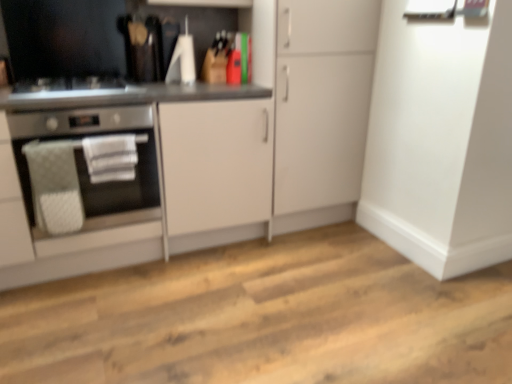
Question: Which direction should I rotate to look at white matte cabinet at center, which appears as the second cabinetry when viewed from the left, — up or down?

Choices:
 (A) up
 (B) down

Answer: (A)

Question: Is stainless steel oven at left positioned with its back to white matte cabinet at center, the 1th cabinetry viewed from the right?

Choices:
 (A) yes
 (B) no

Answer: (B)

Question: Can you confirm if stainless steel oven at left is positioned to the right of white matte cabinet at center, the 1th cabinetry viewed from the right?

Choices:
 (A) no
 (B) yes

Answer: (A)

Question: From a real-world perspective, does stainless steel oven at left sit lower than white matte cabinet at center, the 1th cabinetry viewed from the right?

Choices:
 (A) yes
 (B) no

Answer: (A)

Question: Is stainless steel oven at left next to white matte cabinet at center, which appears as the second cabinetry when viewed from the left?

Choices:
 (A) yes
 (B) no

Answer: (B)

Question: Is stainless steel oven at left at the left side of white matte cabinet at center, the 1th cabinetry viewed from the right?

Choices:
 (A) no
 (B) yes

Answer: (B)

Question: Does stainless steel oven at left have a larger size compared to white matte cabinet at center, which appears as the second cabinetry when viewed from the left?

Choices:
 (A) yes
 (B) no

Answer: (B)

Question: Is white matte cabinet at center, which appears as the second cabinetry when viewed from the left, taller than stainless steel oven at left?

Choices:
 (A) yes
 (B) no

Answer: (A)

Question: Is white matte cabinet at center, which appears as the second cabinetry when viewed from the left, directly adjacent to stainless steel oven at left?

Choices:
 (A) yes
 (B) no

Answer: (B)

Question: From a real-world perspective, is white matte cabinet at center, the 1th cabinetry viewed from the right, below stainless steel oven at left?

Choices:
 (A) no
 (B) yes

Answer: (A)

Question: Is white matte cabinet at center, the 1th cabinetry viewed from the right, turned away from stainless steel oven at left?

Choices:
 (A) yes
 (B) no

Answer: (B)

Question: Considering the relative sizes of white matte cabinet at center, the 1th cabinetry viewed from the right, and stainless steel oven at left in the image provided, is white matte cabinet at center, the 1th cabinetry viewed from the right, smaller than stainless steel oven at left?

Choices:
 (A) yes
 (B) no

Answer: (B)

Question: Is the depth of white matte cabinet at center, the 1th cabinetry viewed from the right, greater than that of stainless steel oven at left?

Choices:
 (A) yes
 (B) no

Answer: (A)

Question: Is white matte cabinet at center, the 1th cabinetry viewed from the right, to the right of matte white cabinet at center, the first cabinetry positioned from the left, from the viewer's perspective?

Choices:
 (A) no
 (B) yes

Answer: (B)